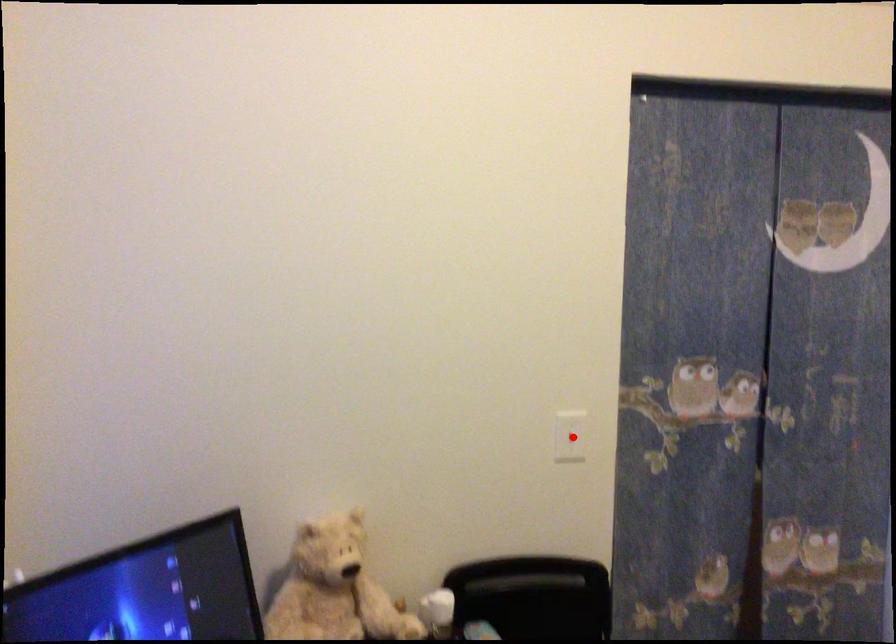
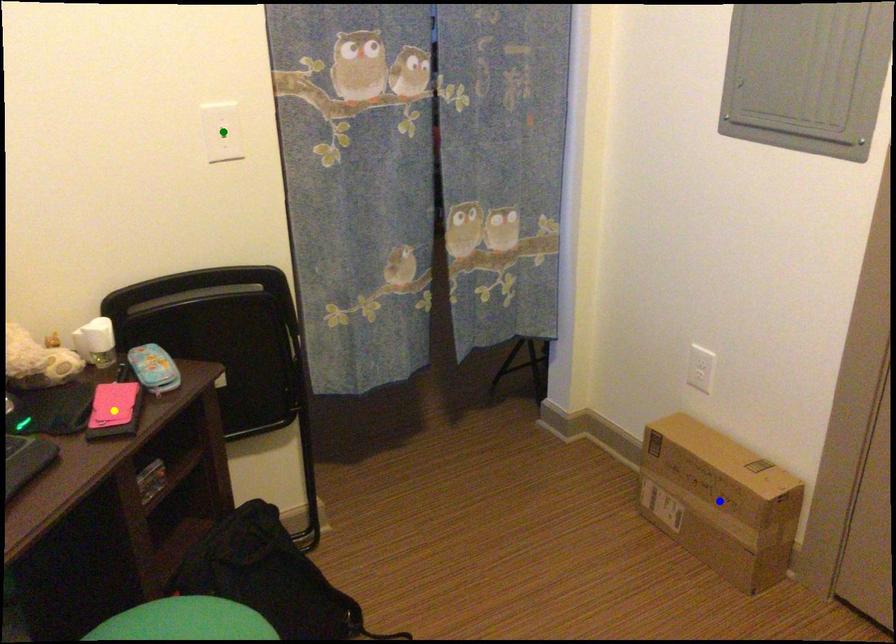
Question: I am providing you with two images of the same scene from different viewpoints. A red point is marked on the first image. You are given multiple points on the second image. Which spot in image 2 lines up with the point in image 1?

Choices:
 (A) yellow point
 (B) green point
 (C) blue point

Answer: (B)